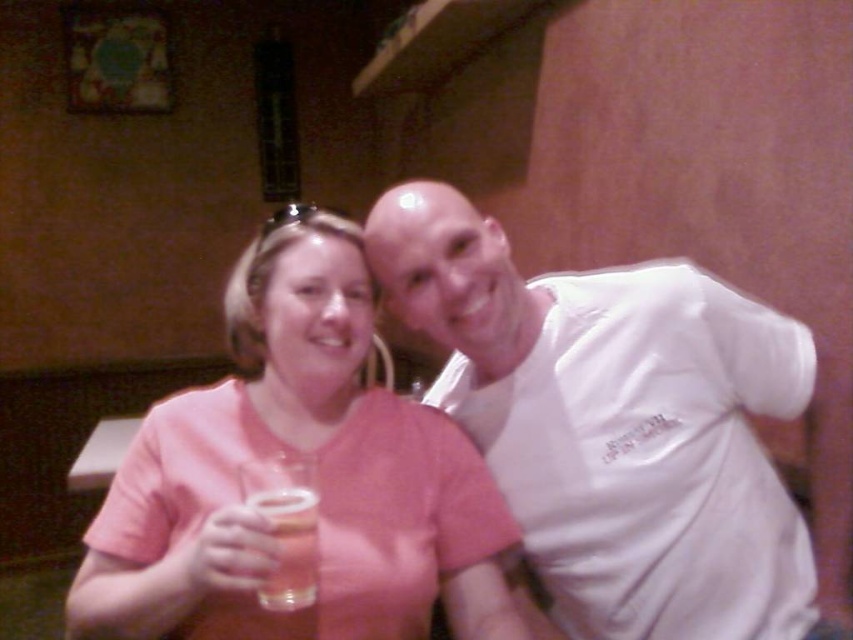
Can you confirm if white cotton shirt at upper right is positioned to the right of translucent glass beer at center?

Yes, white cotton shirt at upper right is to the right of translucent glass beer at center.

Does white cotton shirt at upper right appear over translucent glass beer at center?

Correct, white cotton shirt at upper right is located above translucent glass beer at center.

Between point (677, 556) and point (306, 556), which one is positioned behind?

Positioned behind is point (677, 556).

The height and width of the screenshot is (640, 853). Identify the location of white cotton shirt at upper right. (614, 422).

Which is below, pink matte shirt at center or translucent glass beer at center?

translucent glass beer at center

Can you confirm if pink matte shirt at center is positioned to the right of translucent glass beer at center?

No, pink matte shirt at center is not to the right of translucent glass beer at center.

I want to click on pink matte shirt at center, so [x=317, y=467].

The width and height of the screenshot is (853, 640). Identify the location of pink matte shirt at center. (317, 467).

What do you see at coordinates (614, 422) in the screenshot? This screenshot has width=853, height=640. I see `white cotton shirt at upper right` at bounding box center [614, 422].

Does white cotton shirt at upper right appear on the left side of pink matte shirt at center?

Incorrect, white cotton shirt at upper right is not on the left side of pink matte shirt at center.

Does point (662, 307) come behind point (310, 330)?

Yes, point (662, 307) is behind point (310, 330).

Where is `white cotton shirt at upper right`? The image size is (853, 640). white cotton shirt at upper right is located at coordinates (614, 422).